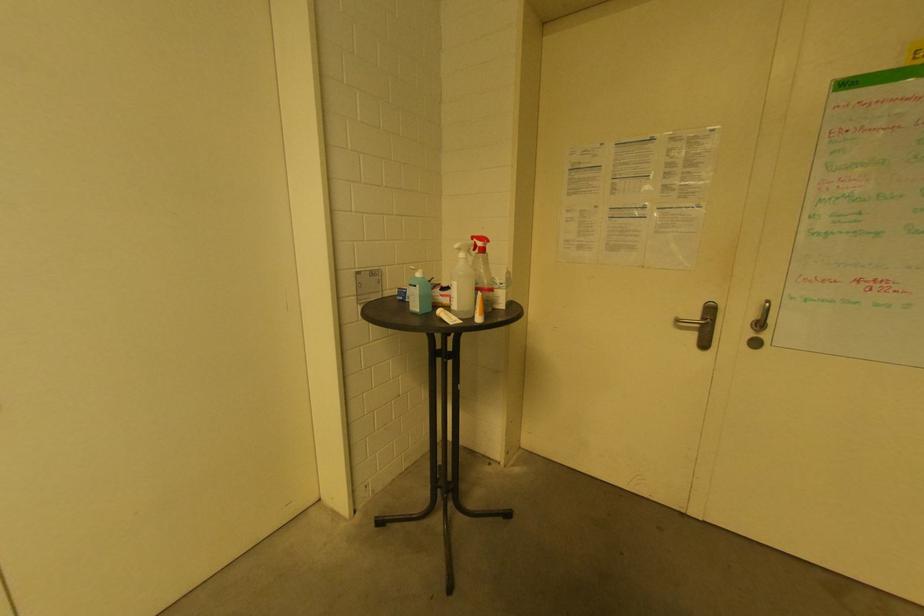
Where is `red spray trigger`? The height and width of the screenshot is (616, 924). red spray trigger is located at coordinates (480, 309).